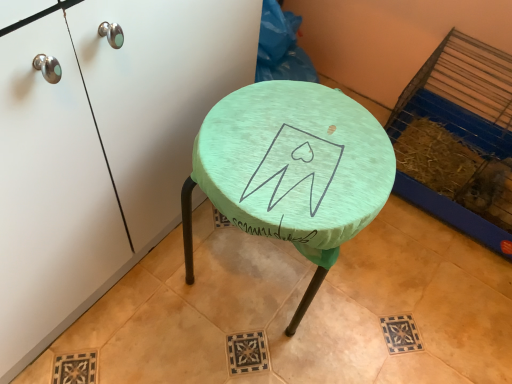
You are a GUI agent. You are given a task and a screenshot of the screen. Output one action in this format:
    pyautogui.click(x=<x>, y=<y>)
    Task: Click on the vacant space positioned to the left of teal fabric stool at center
    Image resolution: width=512 pixels, height=384 pixels.
    Given the screenshot: What is the action you would take?
    tap(154, 284)